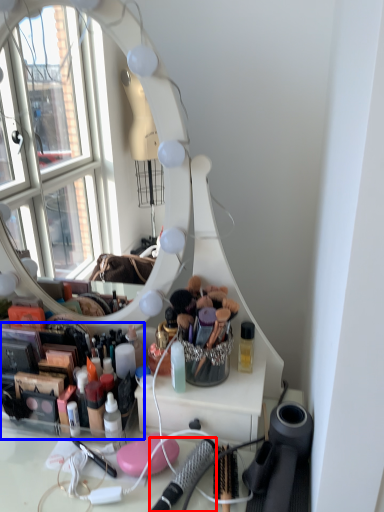
Question: Which object appears closest to the camera in this image, brush (highlighted by a red box) or toiletry (highlighted by a blue box)?

Choices:
 (A) brush
 (B) toiletry

Answer: (A)